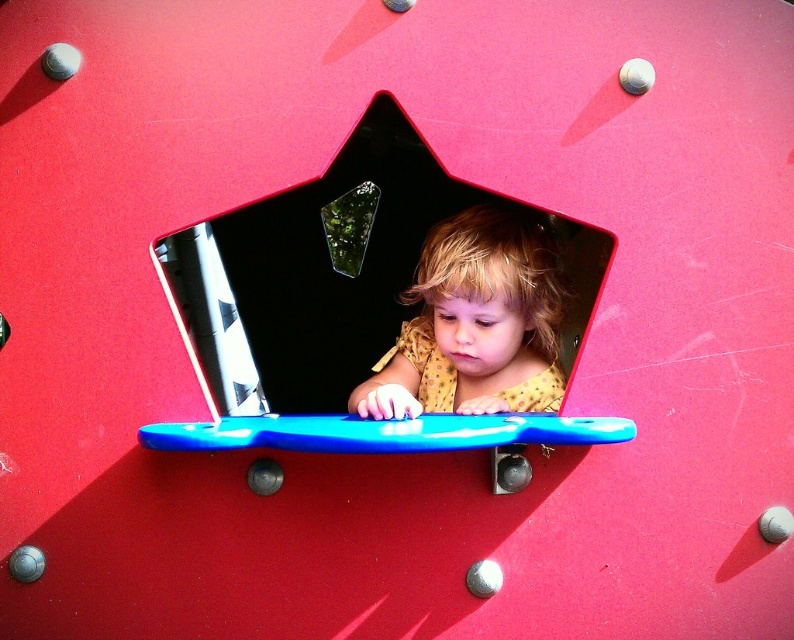
Between polka dot fabric at center and matte plastic toy at center, which one is positioned lower?

polka dot fabric at center

Which is in front, point (403, 397) or point (623, 81)?

Point (403, 397)

Between point (376, 396) and point (650, 72), which one is positioned in front?

Positioned in front is point (376, 396).

The height and width of the screenshot is (640, 794). Find the location of `polka dot fabric at center`. polka dot fabric at center is located at coordinates (473, 324).

Is point (164, 448) less distant than point (638, 90)?

Yes, it is.

Is point (386, 316) positioned in front of point (619, 81)?

No.

Image resolution: width=794 pixels, height=640 pixels. Identify the location of black glossy star at center. (426, 340).

What do you see at coordinates (426, 340) in the screenshot? This screenshot has height=640, width=794. I see `black glossy star at center` at bounding box center [426, 340].

Can you confirm if black glossy star at center is taller than polka dot fabric at center?

Indeed, black glossy star at center has a greater height compared to polka dot fabric at center.

Does point (424, 214) come behind point (461, 323)?

Yes.

The image size is (794, 640). I want to click on black glossy star at center, so click(426, 340).